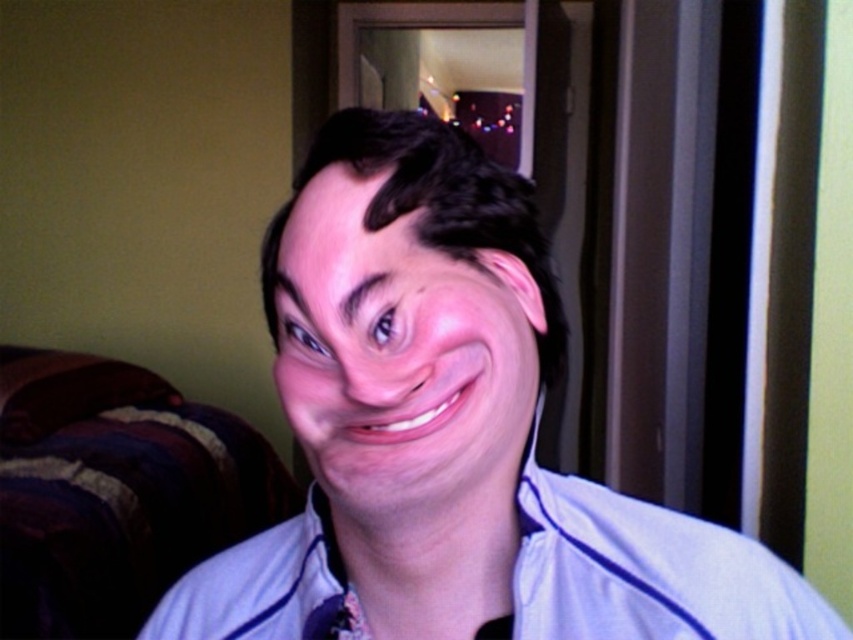
Question: Can you confirm if light blue fabric dress shirt at center is positioned to the right of purple fabric at center?

Choices:
 (A) yes
 (B) no

Answer: (A)

Question: Is light blue fabric dress shirt at center wider than purple fabric at center?

Choices:
 (A) no
 (B) yes

Answer: (B)

Question: Can you confirm if blue fabric shirt at center is positioned to the right of light blue fabric dress shirt at center?

Choices:
 (A) no
 (B) yes

Answer: (A)

Question: Which of the following is the farthest from the observer?

Choices:
 (A) (775, 592)
 (B) (339, 621)
 (C) (297, 212)

Answer: (A)

Question: Among these points, which one is farthest from the camera?

Choices:
 (A) (328, 634)
 (B) (691, 609)

Answer: (B)

Question: Which point is farther to the camera?

Choices:
 (A) light blue fabric dress shirt at center
 (B) purple fabric at center

Answer: (B)